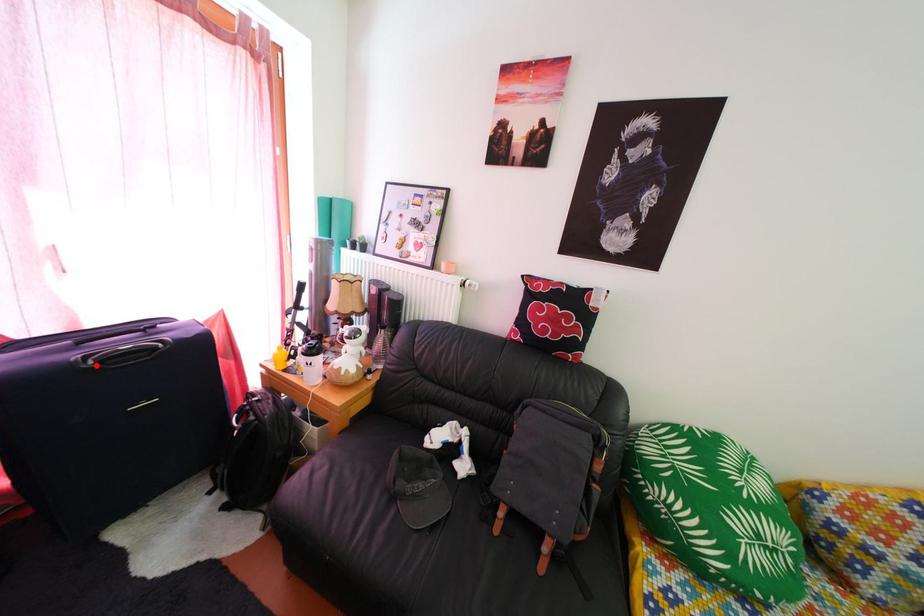
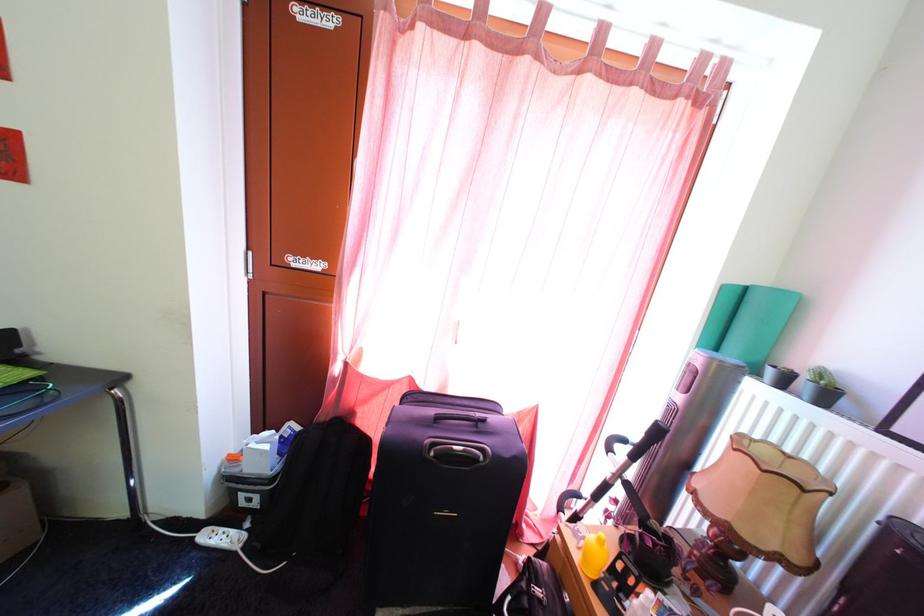
Question: I am providing you with two images of the same scene from different viewpoints. A red point is marked on the first image. At the location where the point appears in image 1, is it still visible in image 2?

Choices:
 (A) Yes
 (B) No

Answer: (A)